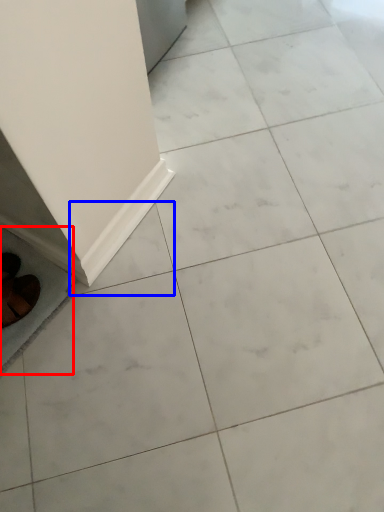
Question: Which object is closer to the camera taking this photo, ceramic tile (highlighted by a red box) or ceramic tile (highlighted by a blue box)?

Choices:
 (A) ceramic tile
 (B) ceramic tile

Answer: (A)